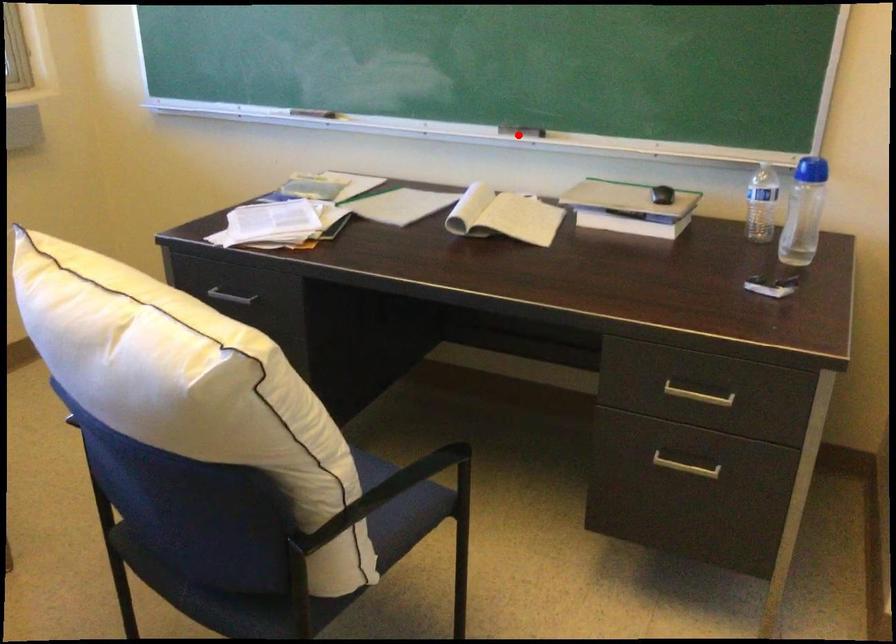
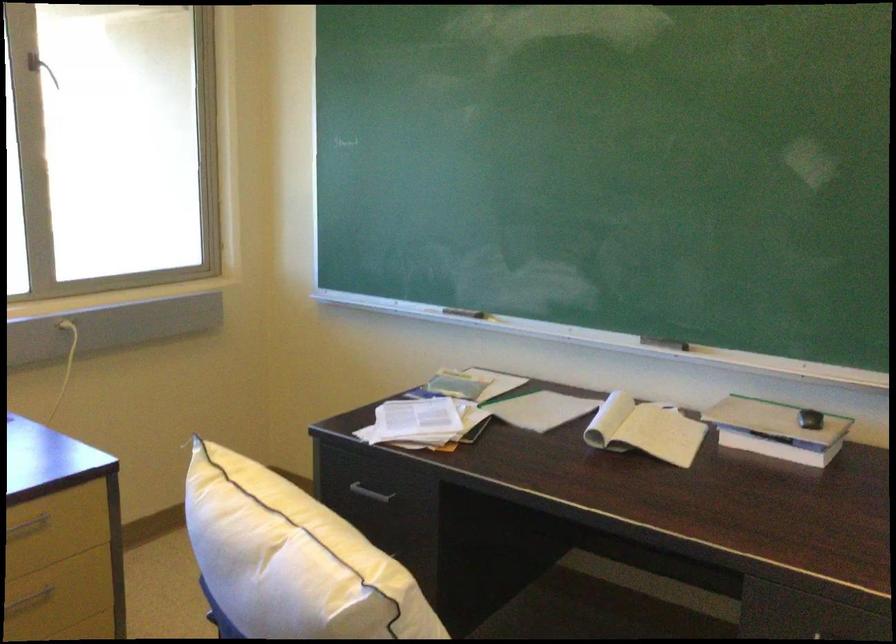
Find the pixel in the second image that matches the highlighted location in the first image.

(664, 343)